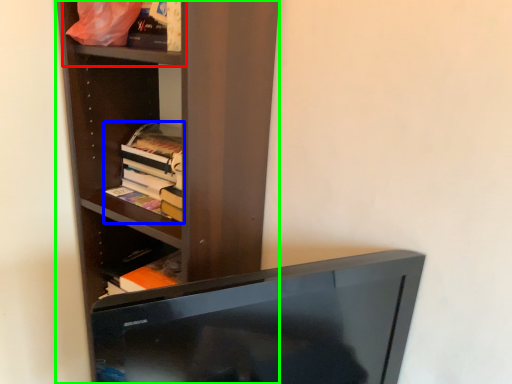
Question: Which object is positioned closest to cabinet (highlighted by a red box)? Select from book (highlighted by a blue box) and shelf (highlighted by a green box).

Choices:
 (A) book
 (B) shelf

Answer: (B)